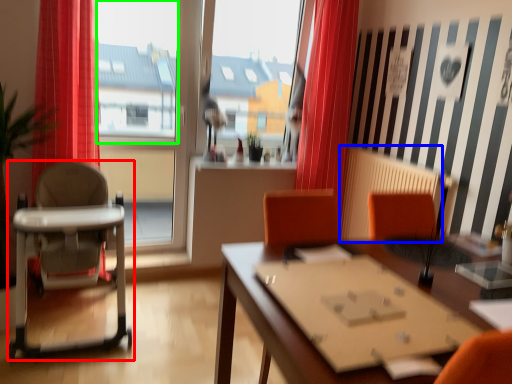
Question: Which is nearer to the chair (highlighted by a red box)? radiator (highlighted by a blue box) or window screen (highlighted by a green box).

Choices:
 (A) radiator
 (B) window screen

Answer: (B)